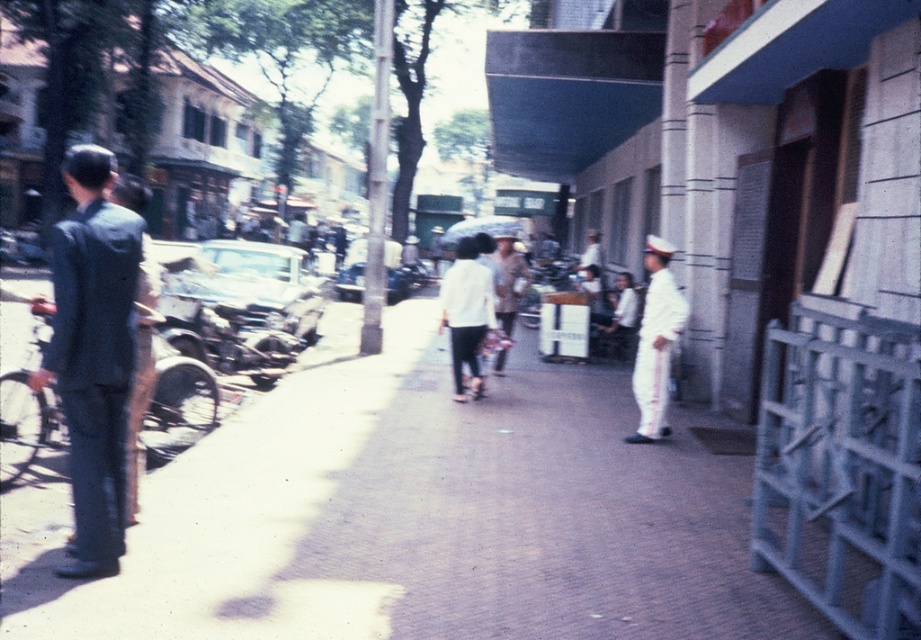
You are a photographer standing at the center of the street. You want to take a photo of the dark blue suit at left and the white matte shirt at center. How far apart are these two subjects in meters?

The dark blue suit at left is 4.82 meters away from the white matte shirt at center.

You are a photographer trying to capture a clear shot of the white matte shirt at center and the white uniform at center. Since both are white, you need to differentiate them by their position. Which one is located to the left?

The white matte shirt at center is positioned on the left side of white uniform at center, so the white matte shirt at center is on the left.